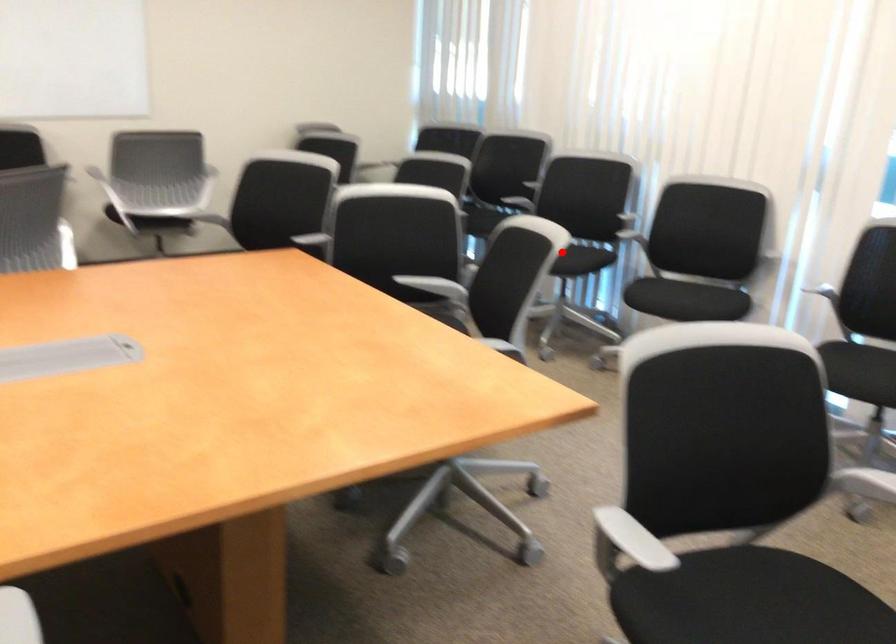
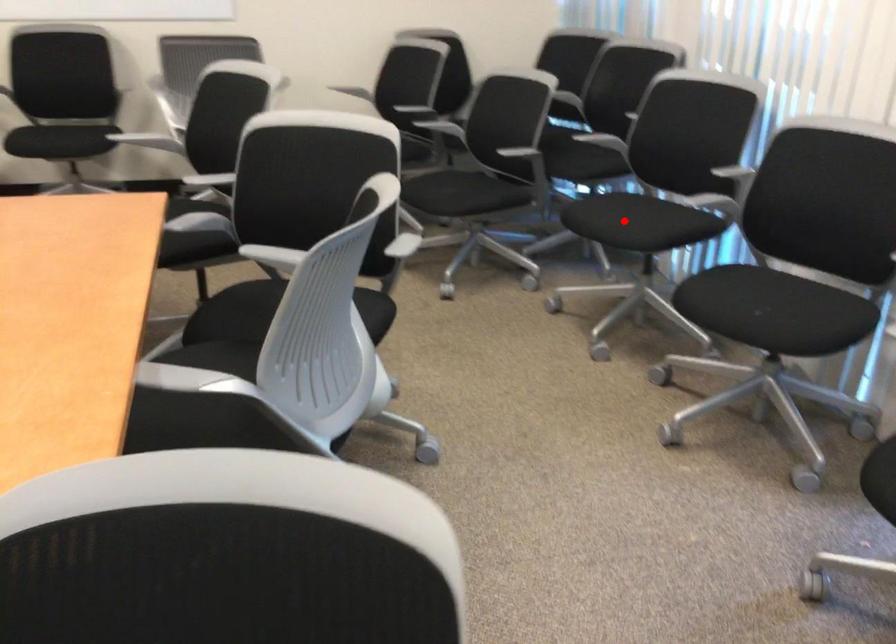
I am providing you with two images of the same scene from different viewpoints. A red point is marked on the first image and another point is marked on the second image. Does the point marked in image1 correspond to the same location as the one in image2?

Yes